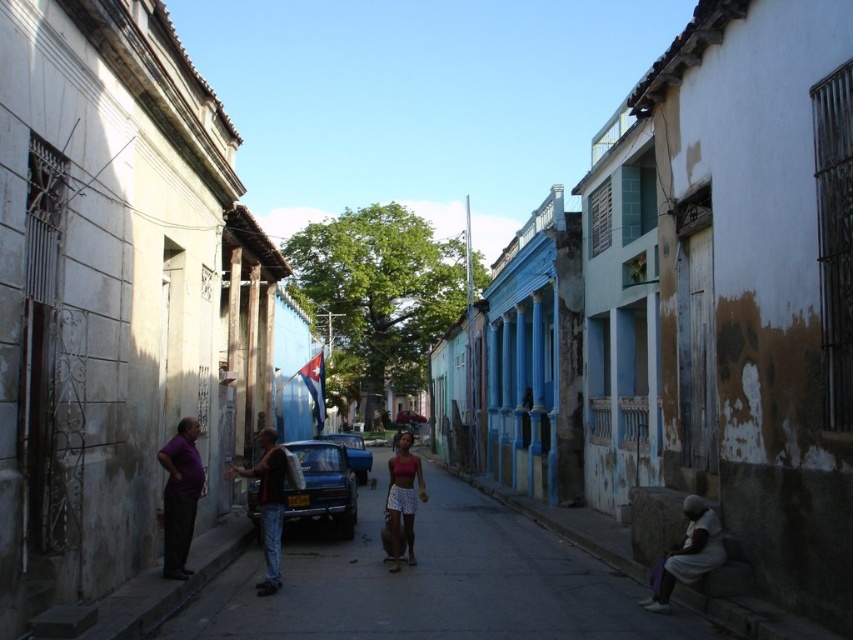
Does metallic blue car at center have a greater height compared to matte purple shirt at left?

No.

Does metallic blue car at center have a lesser width compared to matte purple shirt at left?

No.

I want to click on metallic blue car at center, so click(x=323, y=484).

Does matte purple shirt at left have a lesser width compared to dark gray fabric at lower right?

Indeed, matte purple shirt at left has a lesser width compared to dark gray fabric at lower right.

Is point (175, 560) farther from viewer compared to point (688, 576)?

Yes, point (175, 560) is farther from viewer.

Identify the location of matte purple shirt at left. The image size is (853, 640). (180, 496).

Measure the distance between smooth asphalt road at center and camera.

smooth asphalt road at center and camera are 6.96 meters apart from each other.

Is smooth asphalt road at center smaller than blue metallic car at center?

Yes.

Identify the location of smooth asphalt road at center. This screenshot has width=853, height=640. (433, 584).